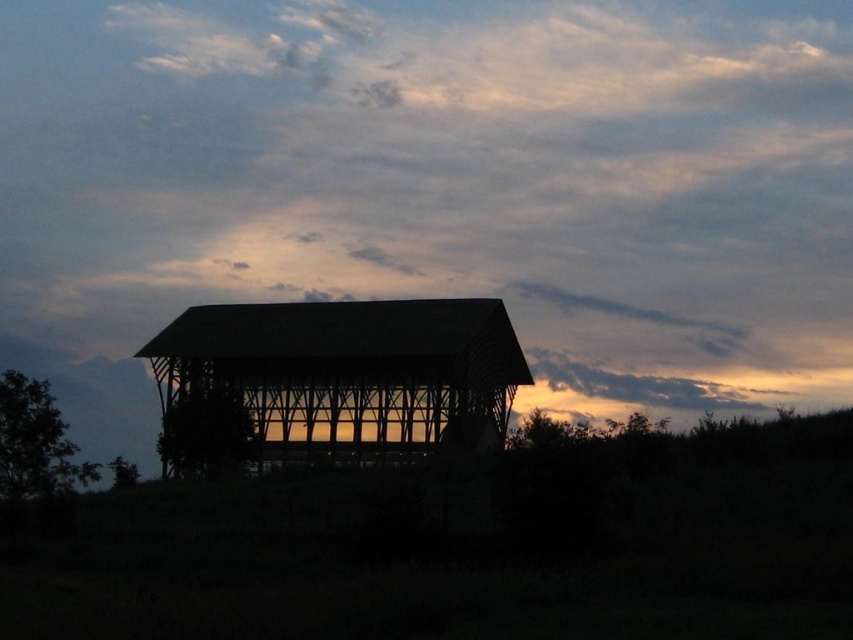
Can you confirm if cloudy sky at upper center is positioned above silhouette wood barn at center?

Yes.

Is cloudy sky at upper center further to camera compared to silhouette wood barn at center?

Yes, cloudy sky at upper center is behind silhouette wood barn at center.

Who is more forward, (408, 140) or (363, 332)?

Positioned in front is point (363, 332).

Where is `cloudy sky at upper center`? Image resolution: width=853 pixels, height=640 pixels. cloudy sky at upper center is located at coordinates (447, 179).